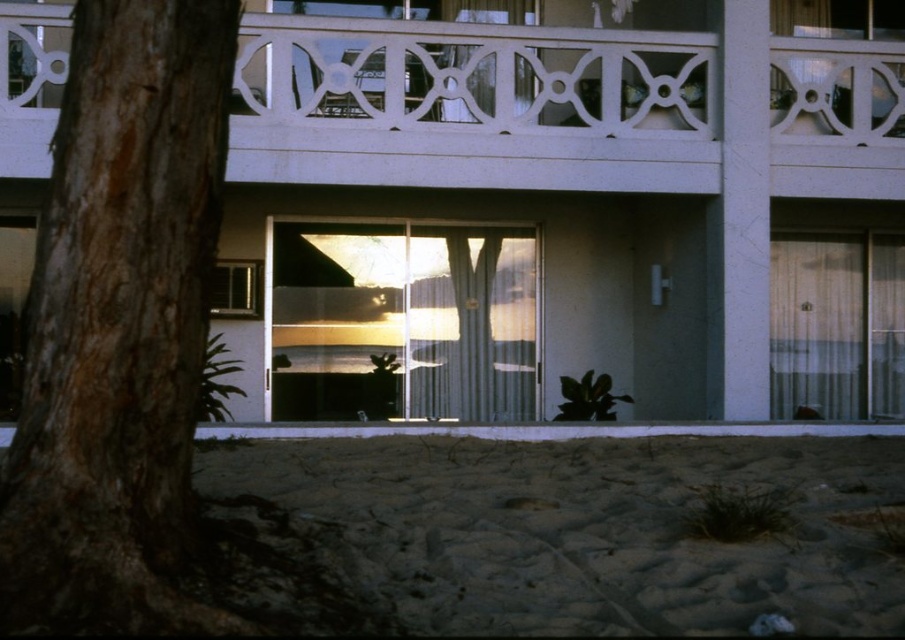
You are a delivery person holding a large package that requires a 1.2 meter wide opening to enter the building. You see the translucent glass door at right and the clear glass window at center. Which entrance should you use to deliver the package?

The translucent glass door at right is wider than the clear glass window at center, so you should use the translucent glass door at right to deliver the package since it can accommodate the 1.2 meter wide opening required.

Based on the photo, you are standing on the beach and looking at the modern building with large glass sliding doors. There is a point marked at coordinates (557, 108). Where is this point located in relation to the building?

The point at coordinates (557, 108) is located on the white textured balcony at upper center of the building.

You are a guest staying in the building and want to enjoy the sunset view. Which of the two options, the white textured balcony at upper center or the translucent glass door at right, offers a wider opening to step outside?

The translucent glass door at right is larger than the white textured balcony at upper center, so it offers a wider opening to step outside.